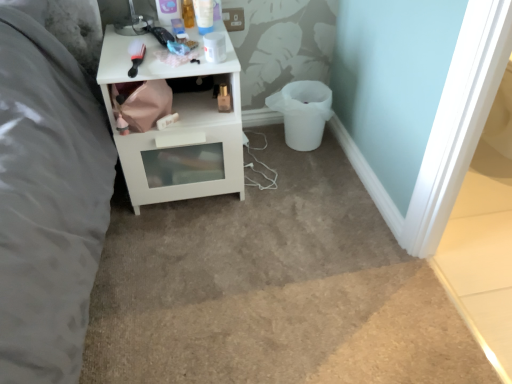
Where is `white glossy nightstand at upper left`? This screenshot has height=384, width=512. white glossy nightstand at upper left is located at coordinates (178, 128).

What do you see at coordinates (178, 128) in the screenshot? I see `white glossy nightstand at upper left` at bounding box center [178, 128].

You are a GUI agent. You are given a task and a screenshot of the screen. Output one action in this format:
    pyautogui.click(x=<x>, y=<y>)
    Task: Click on the white plastic bucket at lower right
    The width and height of the screenshot is (512, 384).
    Given the screenshot: What is the action you would take?
    pyautogui.click(x=303, y=112)

The height and width of the screenshot is (384, 512). What do you see at coordinates (303, 112) in the screenshot? I see `white plastic bucket at lower right` at bounding box center [303, 112].

Measure the distance between white plastic bucket at lower right and camera.

They are 1.64 meters apart.

Find the location of a particular element. This screenshot has width=512, height=384. white glossy nightstand at upper left is located at coordinates (178, 128).

Is white glossy nightstand at upper left at the left side of white plastic bucket at lower right?

Yes, white glossy nightstand at upper left is to the left of white plastic bucket at lower right.

From the picture: Who is more distant, white glossy nightstand at upper left or white plastic bucket at lower right?

white plastic bucket at lower right is further away from the camera.

Which is further, (139, 141) or (327, 105)?

The point (327, 105) is farther.

From the image's perspective, would you say white glossy nightstand at upper left is shown under white plastic bucket at lower right?

Yes, from the image's perspective, white glossy nightstand at upper left is beneath white plastic bucket at lower right.

From a real-world perspective, is white glossy nightstand at upper left positioned above or below white plastic bucket at lower right?

From a real-world perspective, white glossy nightstand at upper left is physically above white plastic bucket at lower right.

Is white glossy nightstand at upper left wider or thinner than white plastic bucket at lower right?

white glossy nightstand at upper left is wider than white plastic bucket at lower right.

Looking at this image, does white glossy nightstand at upper left have a lesser height compared to white plastic bucket at lower right?

In fact, white glossy nightstand at upper left may be taller than white plastic bucket at lower right.

Between white glossy nightstand at upper left and white plastic bucket at lower right, which one has larger size?

white glossy nightstand at upper left is bigger.

Is white glossy nightstand at upper left located outside white plastic bucket at lower right?

That's correct, white glossy nightstand at upper left is outside of white plastic bucket at lower right.

Would you say white glossy nightstand at upper left is a long distance from white plastic bucket at lower right?

That's not correct — white glossy nightstand at upper left is a little close to white plastic bucket at lower right.

Is white glossy nightstand at upper left facing away from white plastic bucket at lower right?

No, white glossy nightstand at upper left's orientation is not away from white plastic bucket at lower right.

Can you tell me how much white glossy nightstand at upper left and white plastic bucket at lower right differ in facing direction?

0.000253 degrees.

How distant is white glossy nightstand at upper left from white plastic bucket at lower right?

They are 19.23 inches apart.

Identify the location of nightstand lying below the white plastic bucket at lower right (from the image's perspective). (178, 128).

Considering the relative positions of white plastic bucket at lower right and white glossy nightstand at upper left in the image provided, is white plastic bucket at lower right to the left of white glossy nightstand at upper left from the viewer's perspective?

No.

Which is in front, white plastic bucket at lower right or white glossy nightstand at upper left?

white glossy nightstand at upper left is in front.

Which point is more distant from viewer, (285,104) or (189,95)?

The point (285,104) is farther from the camera.

From the image's perspective, is white plastic bucket at lower right under white glossy nightstand at upper left?

No, from the image's perspective, white plastic bucket at lower right is not beneath white glossy nightstand at upper left.

From a real-world perspective, is white plastic bucket at lower right physically below white glossy nightstand at upper left?

Yes, from a real-world perspective, white plastic bucket at lower right is below white glossy nightstand at upper left.

Considering the relative sizes of white plastic bucket at lower right and white glossy nightstand at upper left in the image provided, is white plastic bucket at lower right wider than white glossy nightstand at upper left?

No, white plastic bucket at lower right is not wider than white glossy nightstand at upper left.

Consider the image. Between white plastic bucket at lower right and white glossy nightstand at upper left, which one has more height?

white glossy nightstand at upper left.

Considering the sizes of objects white plastic bucket at lower right and white glossy nightstand at upper left in the image provided, who is bigger, white plastic bucket at lower right or white glossy nightstand at upper left?

white glossy nightstand at upper left is bigger.

Can we say white plastic bucket at lower right lies outside white glossy nightstand at upper left?

Yes, white plastic bucket at lower right is not within white glossy nightstand at upper left.

Would you say white plastic bucket at lower right is a long distance from white glossy nightstand at upper left?

They are positioned close to each other.

Is white plastic bucket at lower right facing away from white glossy nightstand at upper left?

No, white plastic bucket at lower right is not facing the opposite direction of white glossy nightstand at upper left.

Locate an element on the screen. nightstand on the left side of white plastic bucket at lower right is located at coordinates (178, 128).

Locate an element on the screen. Image resolution: width=512 pixels, height=384 pixels. toilet bowl below the white glossy nightstand at upper left (from a real-world perspective) is located at coordinates (303, 112).

The height and width of the screenshot is (384, 512). Identify the location of toilet bowl that is on the right side of white glossy nightstand at upper left. (303, 112).